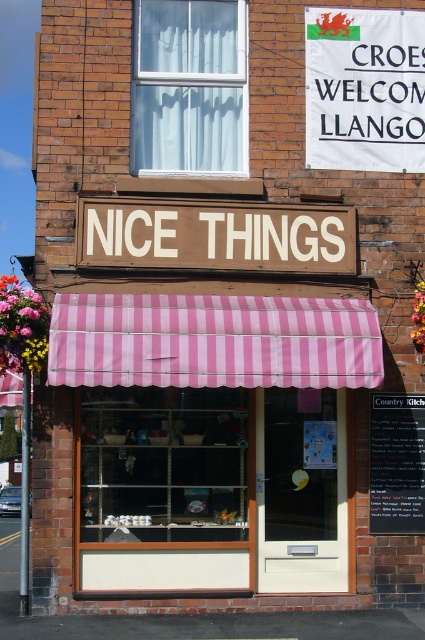
Is white sheer curtain at upper center behind black chalkboard at lower right?

That is True.

Who is more forward, [204,90] or [370,428]?

Point [370,428]

Identify the location of white sheer curtain at upper center. (x=189, y=84).

Does brown wooden sign at center appear over black chalkboard at lower right?

Yes.

Who is more forward, [119,230] or [407,417]?

Positioned in front is point [119,230].

The image size is (425, 640). What are the coordinates of `brown wooden sign at center` in the screenshot? It's located at click(x=215, y=236).

Identify the location of brown wooden sign at center. (215, 236).

Between white sheer curtain at upper center and brown wooden sign at center, which one is positioned lower?

Positioned lower is brown wooden sign at center.

Measure the distance between point (135, 140) and camera.

Point (135, 140) is 32.31 feet away from camera.

Where is `white sheer curtain at upper center`? white sheer curtain at upper center is located at coordinates (189, 84).